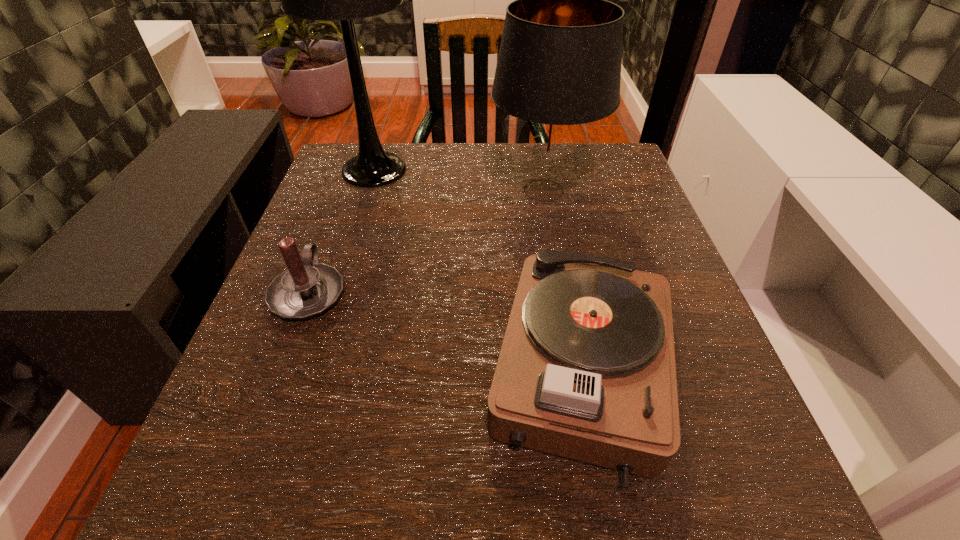
At what (x,y) coordinates should I click in order to perform the action: click on the tallest object. Please return your answer as a coordinate pair (x, y). This screenshot has width=960, height=540. Looking at the image, I should click on (326, 0).

At what (x,y) coordinates should I click in order to perform the action: click on lampshade. Please return your answer as a coordinate pair (x, y). The image size is (960, 540). Looking at the image, I should click on (558, 72).

Where is `candle`? The image size is (960, 540). candle is located at coordinates (307, 288).

You are a GUI agent. You are given a task and a screenshot of the screen. Output one action in this format:
    pyautogui.click(x=<x>, y=<y>)
    Task: Click on the record player
    The height and width of the screenshot is (540, 960).
    Given the screenshot: What is the action you would take?
    pyautogui.click(x=586, y=371)

At what (x,y) coordinates should I click in order to perform the action: click on vacant region located 0.110m on the front of the tallest object. Please return your answer as a coordinate pair (x, y). This screenshot has width=960, height=540. Looking at the image, I should click on (356, 229).

You are a GUI agent. You are given a task and a screenshot of the screen. Output one action in this format:
    pyautogui.click(x=<x>, y=<y>)
    Task: Click on the free region located 0.220m on the front of the second tallest object
    The image size is (960, 540).
    Given the screenshot: What is the action you would take?
    pyautogui.click(x=564, y=307)

This screenshot has height=540, width=960. I want to click on free space located on the side of the candle with the handle loop, so click(x=337, y=217).

Image resolution: width=960 pixels, height=540 pixels. What are the coordinates of `vacant space located on the side of the candle with the handle loop` in the screenshot? It's located at (357, 163).

The width and height of the screenshot is (960, 540). I want to click on vacant space located on the side of the candle with the handle loop, so click(353, 172).

The image size is (960, 540). Identify the location of free spot located on the back of the shortest object. (545, 174).